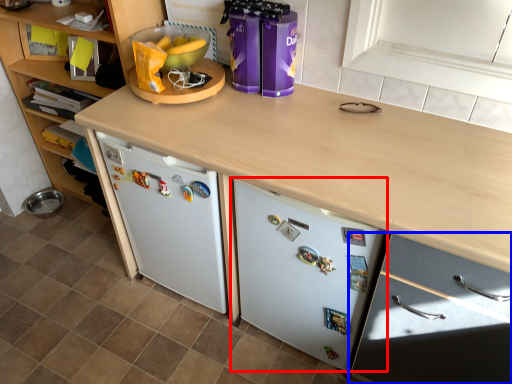
Question: Which point is closer to the camera, refrigerator (highlighted by a red box) or cabinetry (highlighted by a blue box)?

Choices:
 (A) refrigerator
 (B) cabinetry

Answer: (B)